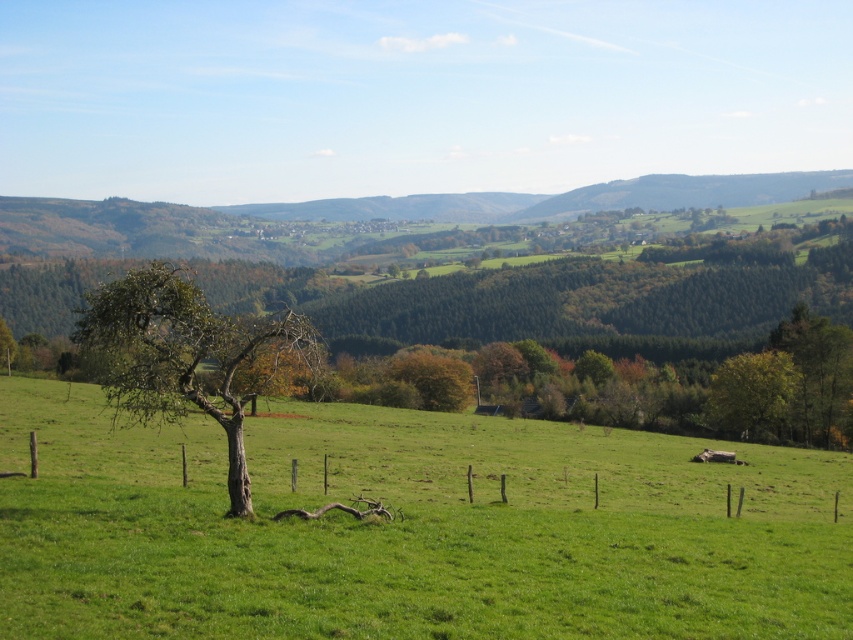
Who is positioned more to the right, green grassy field at center or green leafy tree at right?

green leafy tree at right is more to the right.

Is green grassy field at center in front of green leafy tree at right?

That is True.

Does point (689, 513) lie behind point (749, 365)?

That is False.

Where is `green grassy field at center`? The height and width of the screenshot is (640, 853). green grassy field at center is located at coordinates (409, 529).

Does green grassy field at center have a lesser width compared to bare wood tree at left?

In fact, green grassy field at center might be wider than bare wood tree at left.

Can you confirm if green grassy field at center is positioned below bare wood tree at left?

Yes.

Between point (485, 588) and point (303, 337), which one is positioned in front?

Positioned in front is point (485, 588).

Image resolution: width=853 pixels, height=640 pixels. Identify the location of green grassy field at center. (409, 529).

Does bare wood tree at left appear over green leafy tree at right?

Yes, bare wood tree at left is above green leafy tree at right.

Does bare wood tree at left have a lesser width compared to green leafy tree at right?

No, bare wood tree at left is not thinner than green leafy tree at right.

Locate an element on the screen. The width and height of the screenshot is (853, 640). bare wood tree at left is located at coordinates coord(189,355).

The width and height of the screenshot is (853, 640). I want to click on bare wood tree at left, so click(189, 355).